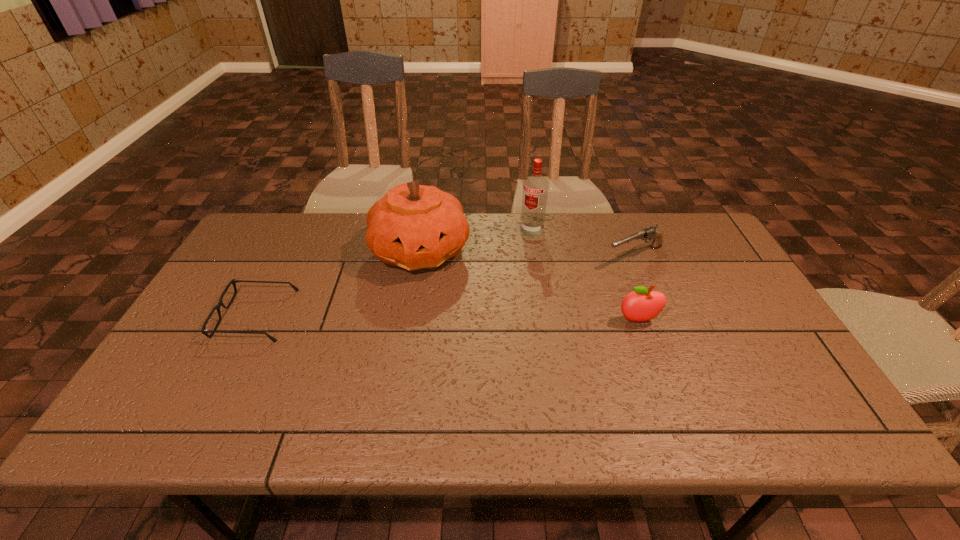
Find the location of a particular element. The height and width of the screenshot is (540, 960). object situated at the left edge is located at coordinates (233, 281).

Where is `vacant point at the far edge`? The height and width of the screenshot is (540, 960). vacant point at the far edge is located at coordinates (481, 225).

In the image, there is a desktop. Identify the location of vacant space at the left edge. (204, 335).

The width and height of the screenshot is (960, 540). What are the coordinates of `free region at the right edge of the desktop` in the screenshot? It's located at (738, 345).

Locate an element on the screen. This screenshot has width=960, height=540. free spot at the far right corner of the desktop is located at coordinates (708, 252).

The image size is (960, 540). What are the coordinates of `free point between the spectacles and the fourth object from right to left` in the screenshot? It's located at (338, 283).

The height and width of the screenshot is (540, 960). I want to click on free space between the gun and the fourth object from right to left, so 528,253.

You are a GUI agent. You are given a task and a screenshot of the screen. Output one action in this format:
    pyautogui.click(x=<x>, y=<y>)
    Task: Click on the empty space that is in between the spectacles and the third object from left to right
    The width and height of the screenshot is (960, 540).
    Given the screenshot: What is the action you would take?
    pyautogui.click(x=394, y=273)

Where is `unoccupied position between the gun and the spectacles`? The image size is (960, 540). unoccupied position between the gun and the spectacles is located at coordinates (445, 286).

Image resolution: width=960 pixels, height=540 pixels. What are the coordinates of `empty space between the fourth tallest object and the third object from right to left` in the screenshot? It's located at (583, 243).